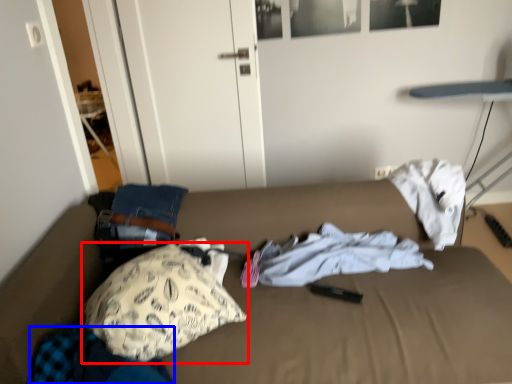
Question: Which object appears closest to the camera in this image, pillow (highlighted by a red box) or clothing (highlighted by a blue box)?

Choices:
 (A) pillow
 (B) clothing

Answer: (B)